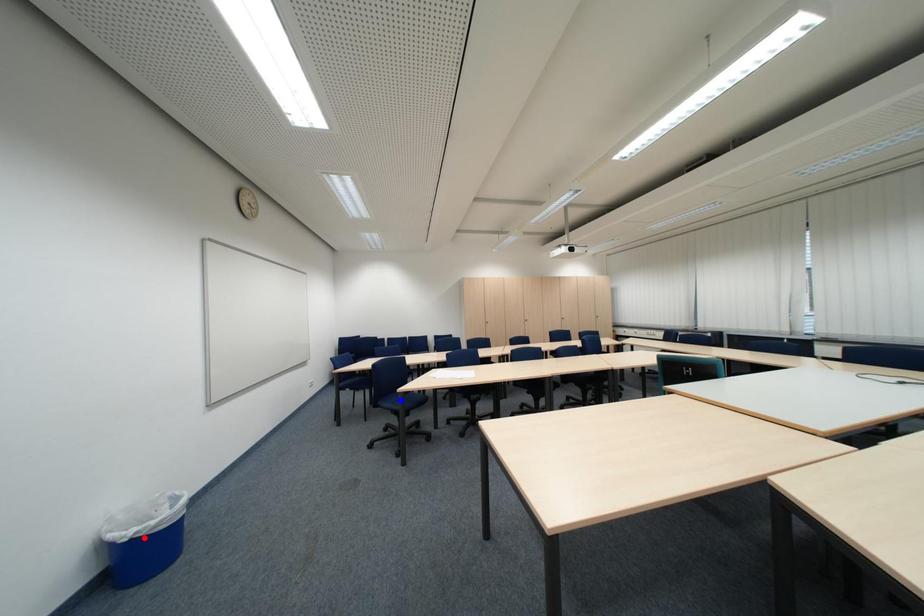
Question: Which of the two points in the image is closer to the camera?

Choices:
 (A) Blue point is closer.
 (B) Red point is closer.

Answer: (B)